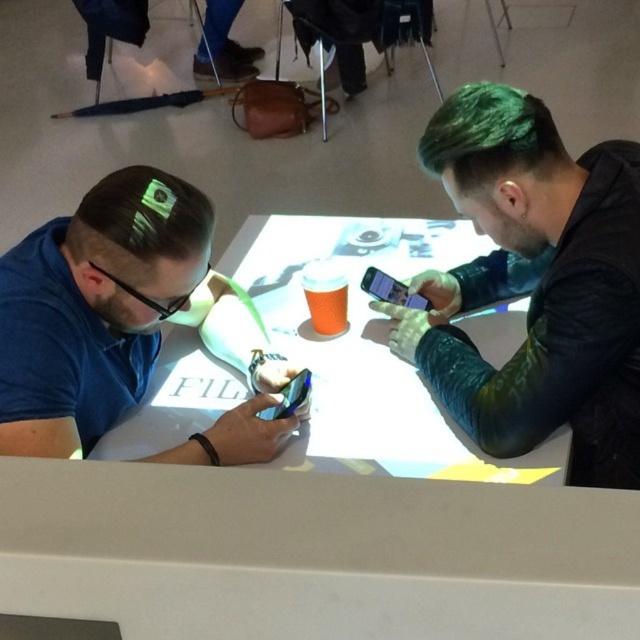
Does point (52, 340) lie behind point (406, 305)?

That is False.

The width and height of the screenshot is (640, 640). I want to click on blue matte shirt at left, so click(93, 307).

Image resolution: width=640 pixels, height=640 pixels. Describe the element at coordinates (93, 307) in the screenshot. I see `blue matte shirt at left` at that location.

You are a GUI agent. You are given a task and a screenshot of the screen. Output one action in this format:
    pyautogui.click(x=<x>, y=<y>)
    Task: Click on the blue matte shirt at left
    The image size is (640, 640).
    Given the screenshot: What is the action you would take?
    pyautogui.click(x=93, y=307)

From the picture: Does green dyed hair at upper right appear on the left side of black matte glasses at left?

In fact, green dyed hair at upper right is to the right of black matte glasses at left.

Is point (492, 84) positioned before point (138, 298)?

No, (492, 84) is behind (138, 298).

Who is more forward, [472,138] or [177,298]?

Positioned in front is point [472,138].

Locate an element on the screen. green dyed hair at upper right is located at coordinates [x=490, y=138].

Is white glossy table at center to the left of green dyed hair at upper right from the viewer's perspective?

Yes, white glossy table at center is to the left of green dyed hair at upper right.

Who is positioned more to the right, white glossy table at center or green dyed hair at upper right?

Positioned to the right is green dyed hair at upper right.

Image resolution: width=640 pixels, height=640 pixels. Identify the location of white glossy table at center. (369, 349).

Where is `white glossy table at center`? white glossy table at center is located at coordinates (369, 349).